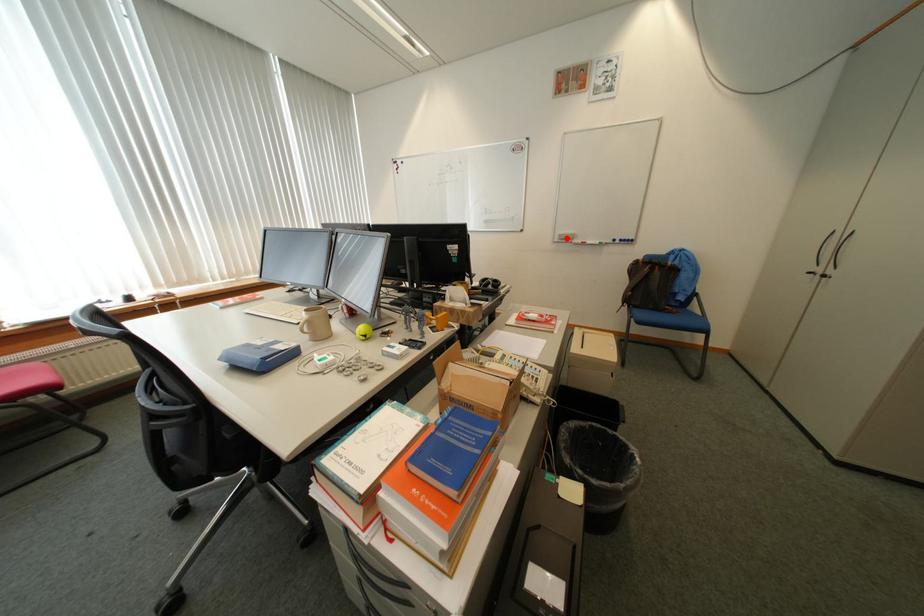
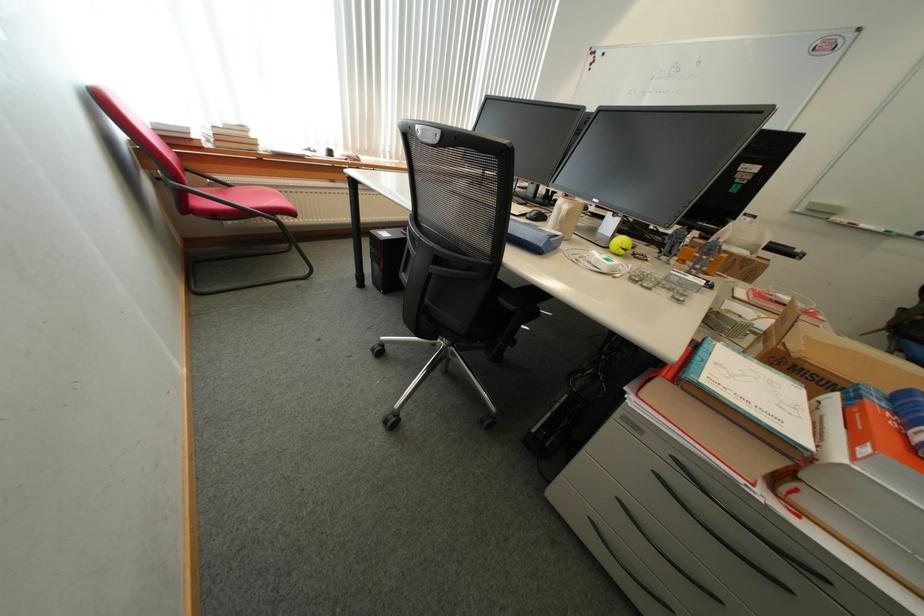
Locate, in the second image, the point that corresponds to the highlighted location in the first image.

(815, 207)